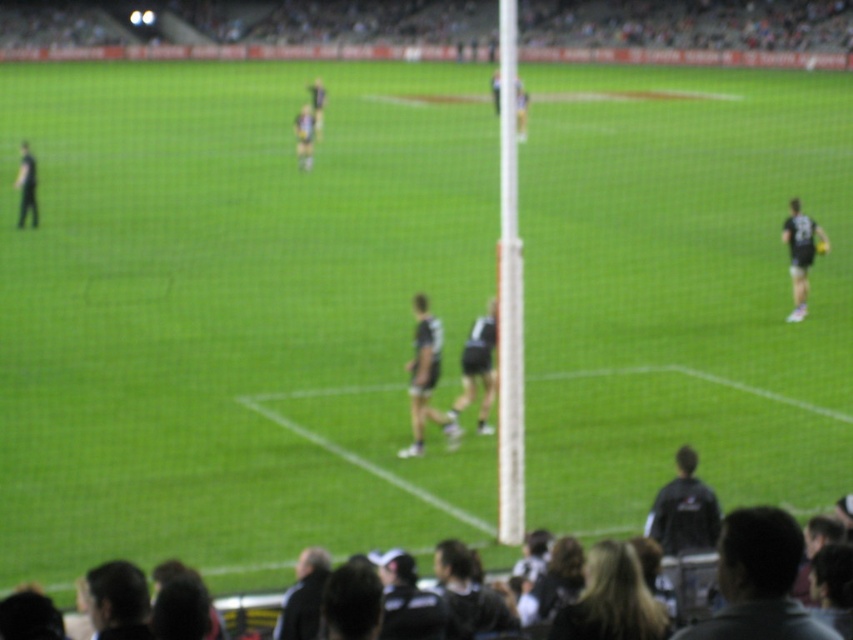
How distant is dark gray jacket at lower right from black uniform at left?

dark gray jacket at lower right and black uniform at left are 111.51 feet apart.

Does dark gray jacket at lower right appear on the left side of black uniform at left?

No, dark gray jacket at lower right is not to the left of black uniform at left.

The height and width of the screenshot is (640, 853). Describe the element at coordinates (758, 580) in the screenshot. I see `dark gray jacket at lower right` at that location.

This screenshot has height=640, width=853. I want to click on dark gray jacket at lower right, so click(x=758, y=580).

Which is above, black jersey at center or dark gray jersey at lower center?

black jersey at center

Measure the distance between point (424, 330) and camera.

Point (424, 330) is 21.05 meters away from camera.

Measure the distance between black jersey at center and camera.

black jersey at center and camera are 20.87 meters apart.

Identify the location of black jersey at center. (425, 378).

Does black jersey at right have a smaller size compared to black uniform at left?

Correct, black jersey at right occupies less space than black uniform at left.

Who is shorter, black jersey at right or black uniform at left?

black jersey at right

Describe the element at coordinates (799, 253) in the screenshot. I see `black jersey at right` at that location.

At what (x,y) coordinates should I click in order to perform the action: click on black jersey at right. Please return your answer as a coordinate pair (x, y). Looking at the image, I should click on (799, 253).